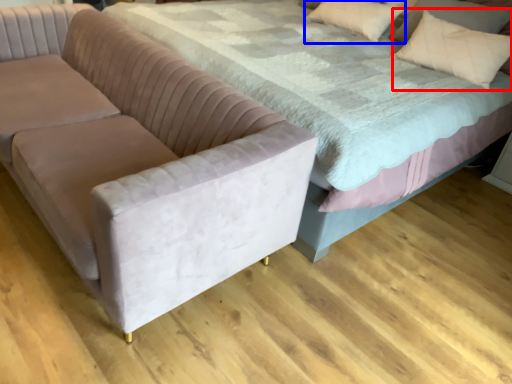
Question: Which object is closer to the camera taking this photo, throw pillow (highlighted by a red box) or pillow (highlighted by a blue box)?

Choices:
 (A) throw pillow
 (B) pillow

Answer: (A)